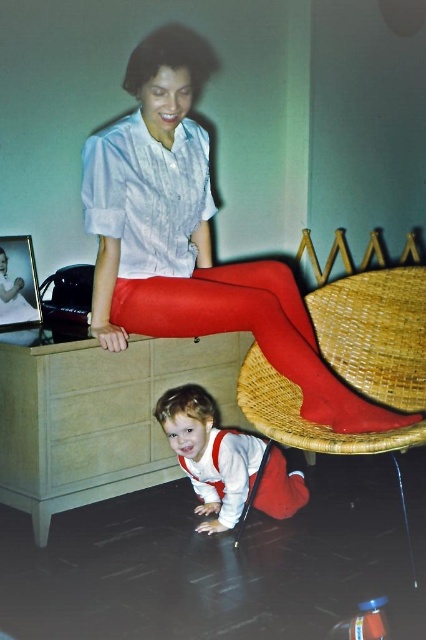
You are a photographer trying to capture a candid shot of the matte red skirt at upper center without including the woven wood chair at lower center in the frame. Based on their positions, is this possible?

The matte red skirt at upper center is in front of the woven wood chair at lower center, so it is possible to capture the matte red skirt at upper center without including the woven wood chair at lower center in the frame by focusing on the foreground.

You are a robot trying to navigate to the child crawling on the dark wooden floor. The robot is currently at point (345,449). The child is at point (313,404). Which direction should you move to reach the child?

Point (345,449) is in front of point (313,404), so you should move backward to reach the child.

You are a parent trying to dress your child. You have two clothing items on the floor in front of you, the matte red tights at lower center and the white cotton onesie at lower center. Which clothing item is on the right side when looking at them from the child crawling on the dark wooden floor?

The matte red tights at lower center is positioned on the right side of white cotton onesie at lower center, so from the child crawling on the dark wooden floor, the matte red tights at lower center is on the right side.